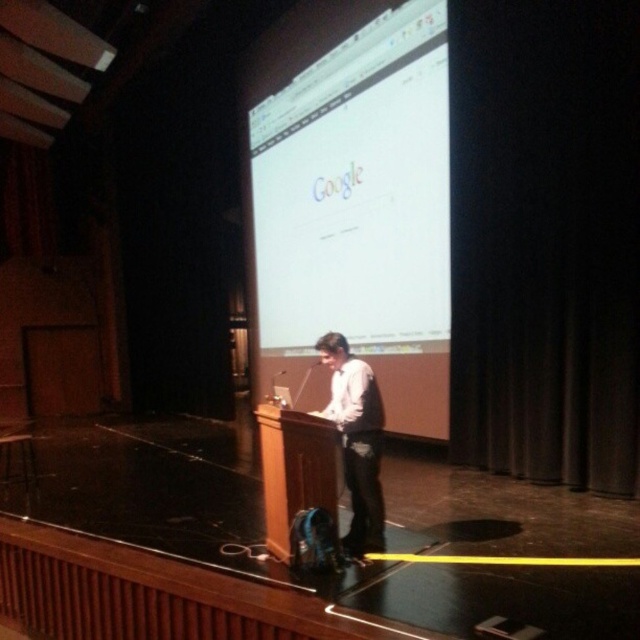
Question: Is white glossy projector screen at center to the left of light brown shirt at center from the viewer's perspective?

Choices:
 (A) no
 (B) yes

Answer: (A)

Question: Is white glossy projector screen at center smaller than light brown shirt at center?

Choices:
 (A) no
 (B) yes

Answer: (A)

Question: Is white glossy projector screen at center above light brown shirt at center?

Choices:
 (A) no
 (B) yes

Answer: (B)